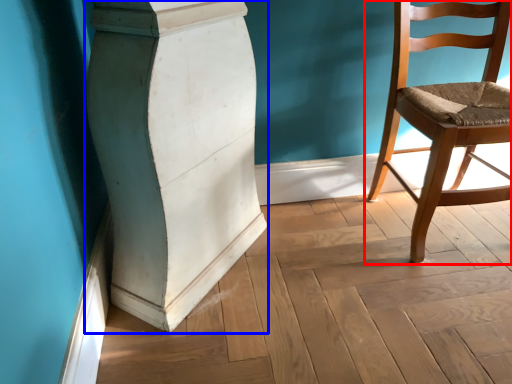
Question: Which point is closer to the camera, chair (highlighted by a red box) or pillar (highlighted by a blue box)?

Choices:
 (A) chair
 (B) pillar

Answer: (B)